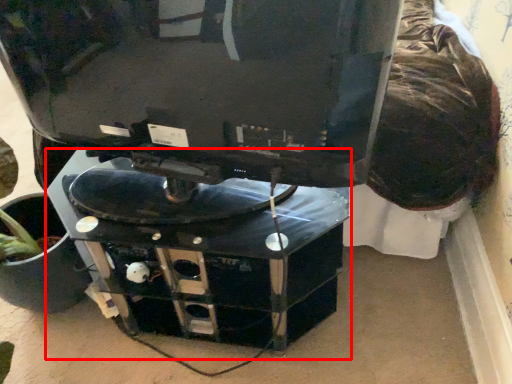
Question: In this image, where is computer desk (annotated by the red box) located relative to computer monitor?

Choices:
 (A) left
 (B) right

Answer: (B)